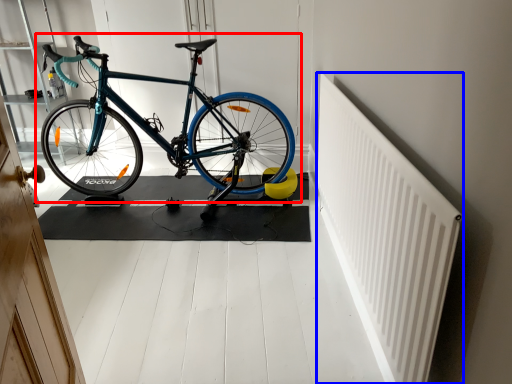
Question: Which of the following is the closest to the observer, bicycle (highlighted by a red box) or radiator (highlighted by a blue box)?

Choices:
 (A) bicycle
 (B) radiator

Answer: (B)